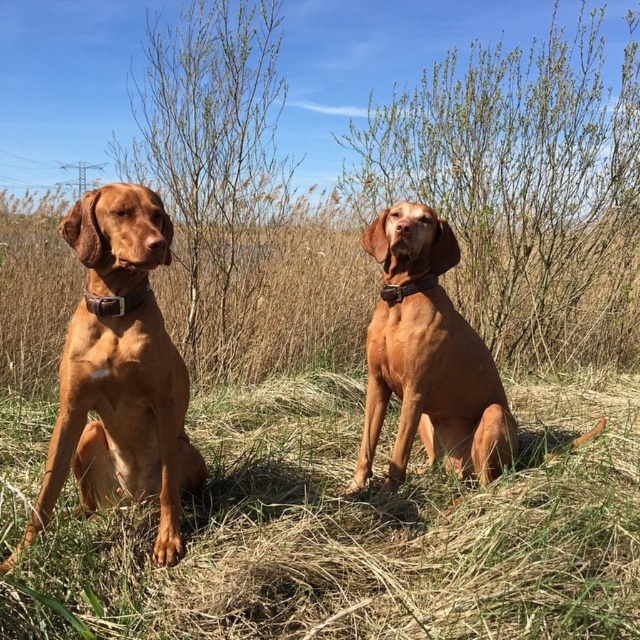
You are a dog trainer observing two Vizsla dogs in an outdoor setting. You notice both dogs have collars. Based on their positions, which collar, the brown leather collar at left or the brown leather collar at center, is closer to you?

The brown leather collar at left is closer to you because it is in front of the brown leather collar at center.

You are a photographer trying to capture both points in the image. Since you can only focus on one point at a time, which point should you focus on first if you want to ensure the other point remains in focus? Please choose between point (77, 401) and point (124, 298).

You should focus on point (124, 298) first because it is closer to the camera than point (77, 401). By focusing on the closer point, the farther point will still be within the depth of field and remain in focus.